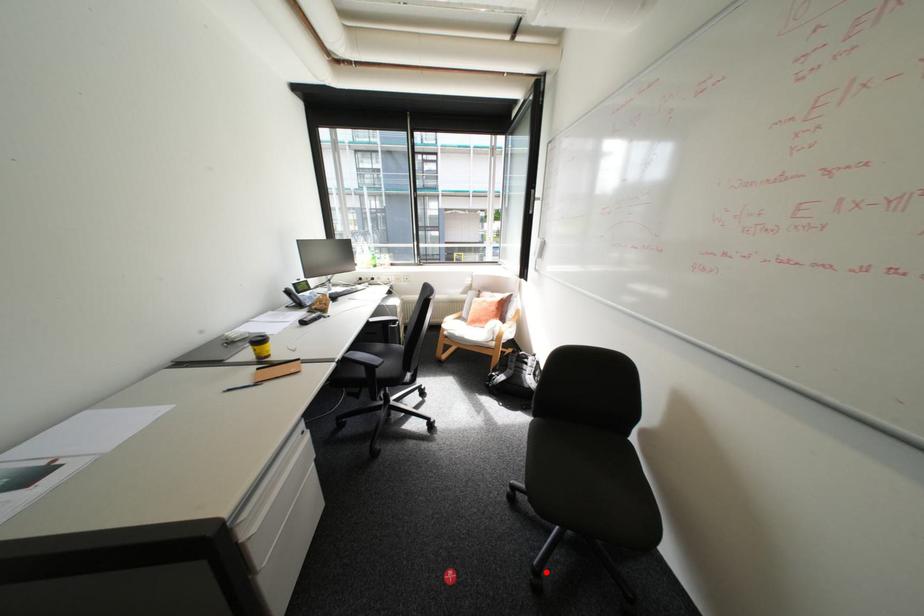
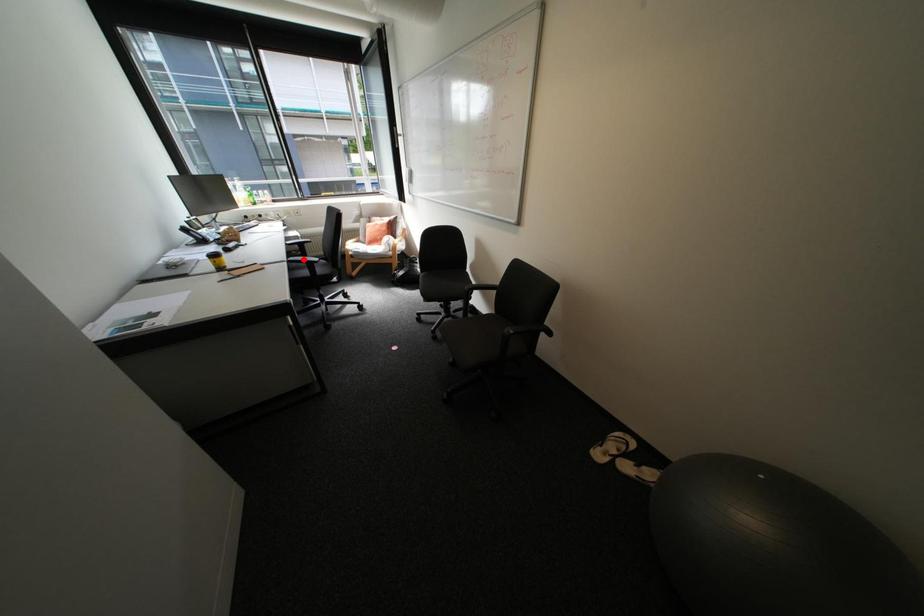
I am providing you with two images of the same scene from different viewpoints. A red point is marked on the first image and another point is marked on the second image. Do the highlighted points in image1 and image2 indicate the same real-world spot?

No